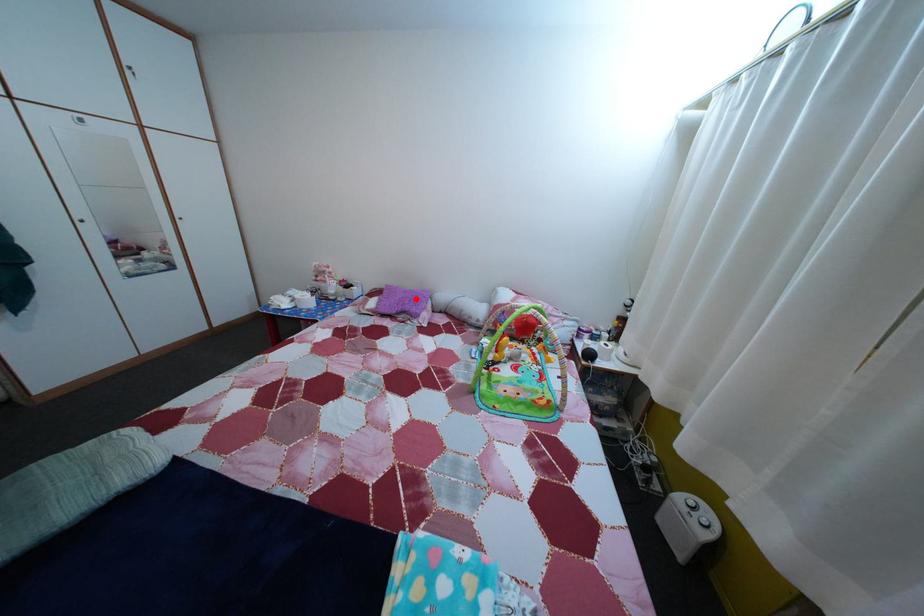
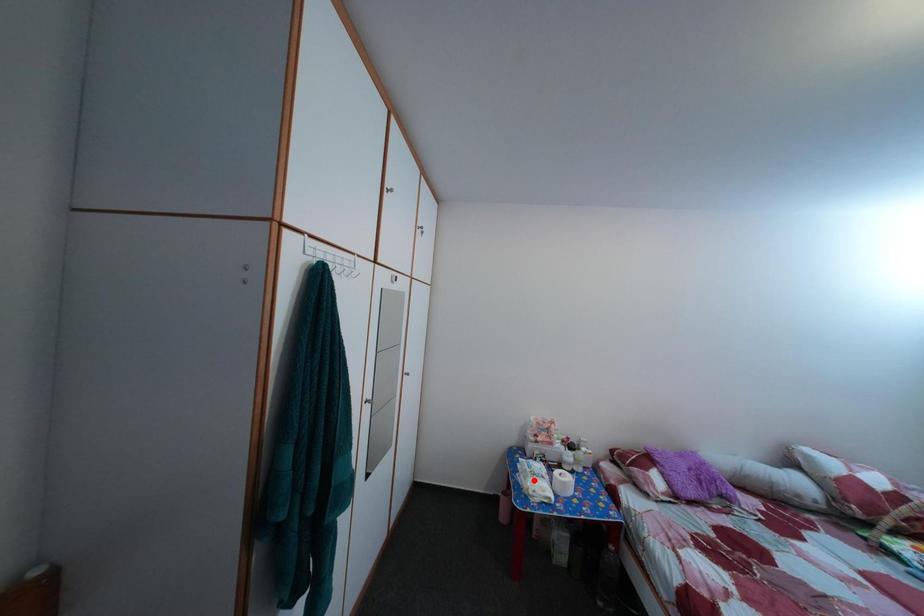
I am providing you with two images of the same scene from different viewpoints. A red point is marked on the first image and another point is marked on the second image. Is the marked point in image1 the same physical position as the marked point in image2?

No